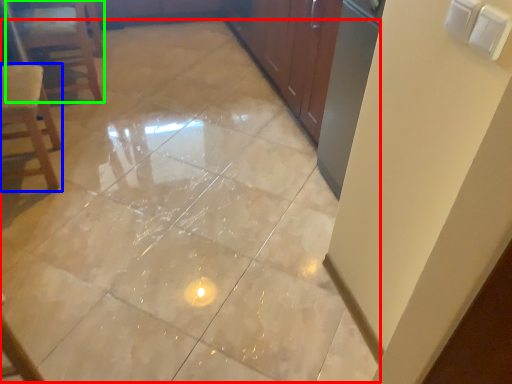
Question: Which object is positioned farthest from ceramic tile (highlighted by a red box)? Select from chair (highlighted by a blue box) and furniture (highlighted by a green box).

Choices:
 (A) chair
 (B) furniture

Answer: (B)